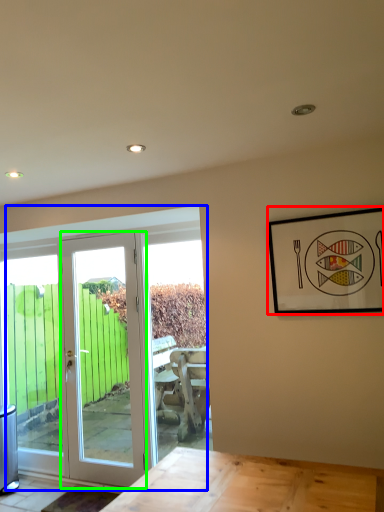
Question: Which is farther away from picture frame (highlighted by a red box)? door (highlighted by a blue box) or door (highlighted by a green box)?

Choices:
 (A) door
 (B) door

Answer: (B)